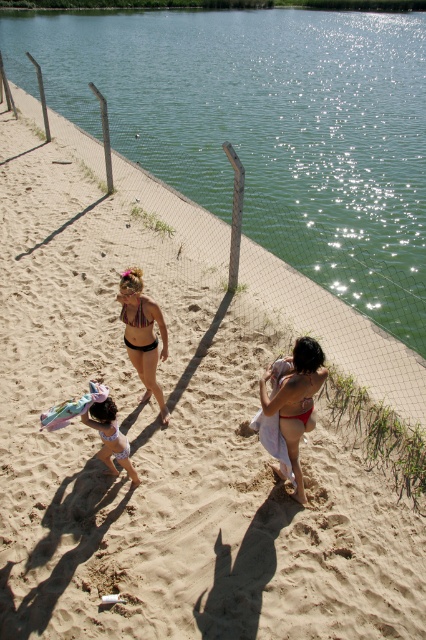
Question: Can you confirm if green water at center is smaller than matte white bikini at center?

Choices:
 (A) yes
 (B) no

Answer: (B)

Question: Estimate the real-world distances between objects in this image. Which object is closer to the matte white bikini at center?

Choices:
 (A) white matte swimsuit at lower left
 (B) multicolored woven bikini top at center
 (C) white matte bikini at center

Answer: (C)

Question: Is multicolored woven bikini top at center positioned in front of matte white bikini at center?

Choices:
 (A) no
 (B) yes

Answer: (A)

Question: Which object is positioned closest to the matte white bikini at center?

Choices:
 (A) white matte bikini at center
 (B) green water at center
 (C) white matte swimsuit at lower left

Answer: (A)

Question: Which of the following is the farthest from the observer?

Choices:
 (A) green water at center
 (B) multicolored bikini top at center
 (C) white matte swimsuit at lower left
 (D) white matte bikini at center

Answer: (A)

Question: Considering the relative positions of green water at center and white matte swimsuit at lower left in the image provided, where is green water at center located with respect to white matte swimsuit at lower left?

Choices:
 (A) above
 (B) below

Answer: (A)